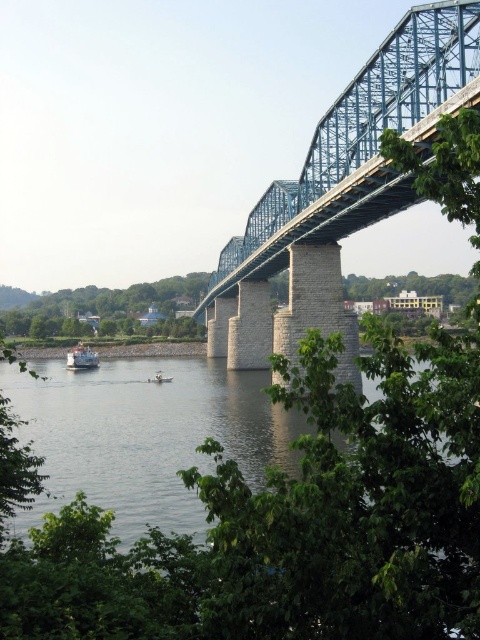
Does metallic gray boat at lower left lie behind white plastic boat at lower left?

Yes, metallic gray boat at lower left is behind white plastic boat at lower left.

Who is more forward, (88, 352) or (160, 372)?

Positioned in front is point (160, 372).

You are a GUI agent. You are given a task and a screenshot of the screen. Output one action in this format:
    pyautogui.click(x=<x>, y=<y>)
    Task: Click on the metallic gray boat at lower left
    
    Given the screenshot: What is the action you would take?
    pyautogui.click(x=82, y=356)

Which is more to the left, blue metallic bridge at upper right or white plastic boat at lower left?

white plastic boat at lower left

Identify the location of blue metallic bridge at upper right. pyautogui.click(x=356, y=150).

Between point (319, 211) and point (157, 381), which one is positioned behind?

The point (157, 381) is more distant.

Identify the location of blue metallic bridge at upper right. (356, 150).

What do you see at coordinates (144, 435) in the screenshot? This screenshot has width=480, height=640. I see `clear water at center` at bounding box center [144, 435].

Consider the image. Is the position of clear water at center less distant than that of blue metallic bridge at upper right?

Yes.

Where is `clear water at center`? clear water at center is located at coordinates (144, 435).